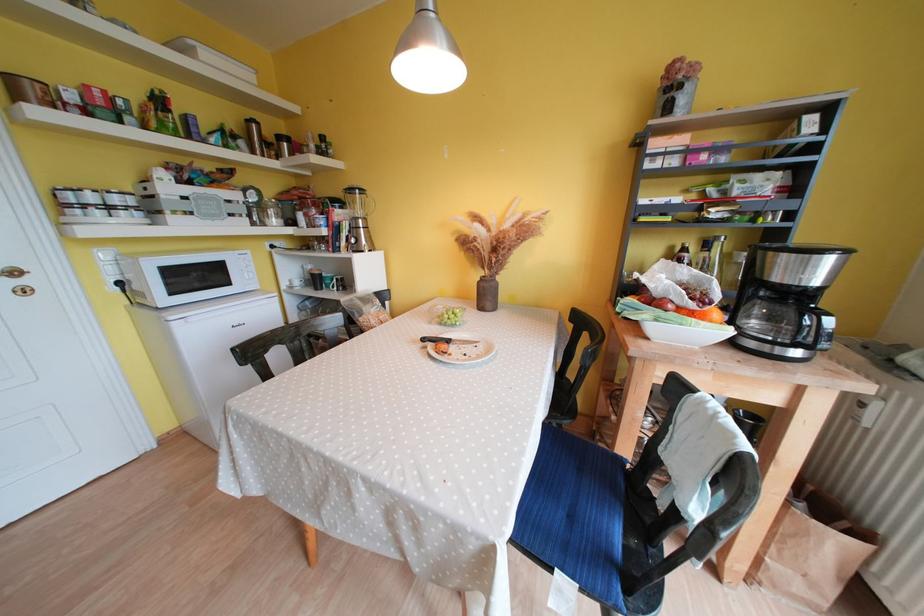
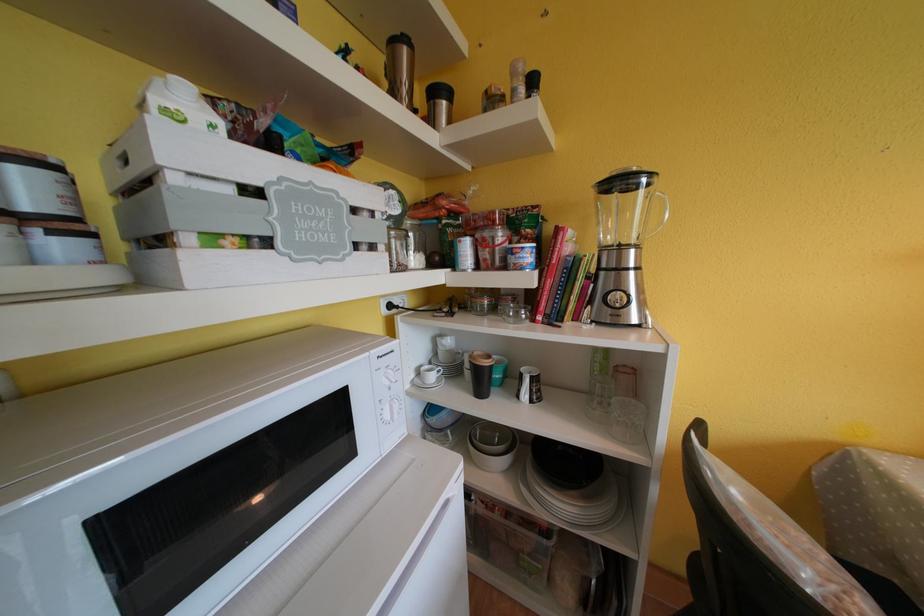
Where in the second image is the point corresponding to point 304,286 from the first image?

(439, 381)